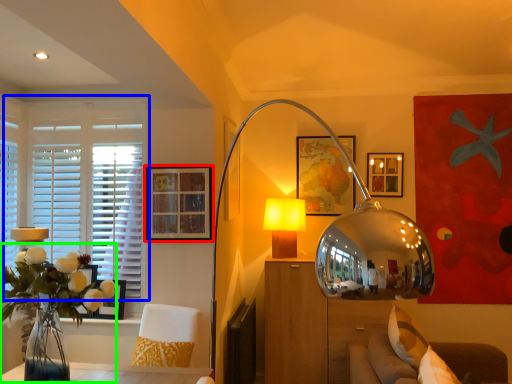
Question: Estimate the real-world distances between objects in this image. Which object is closer to picture frame (highlighted by a red box), window (highlighted by a blue box) or floral arrangement (highlighted by a green box)?

Choices:
 (A) window
 (B) floral arrangement

Answer: (A)